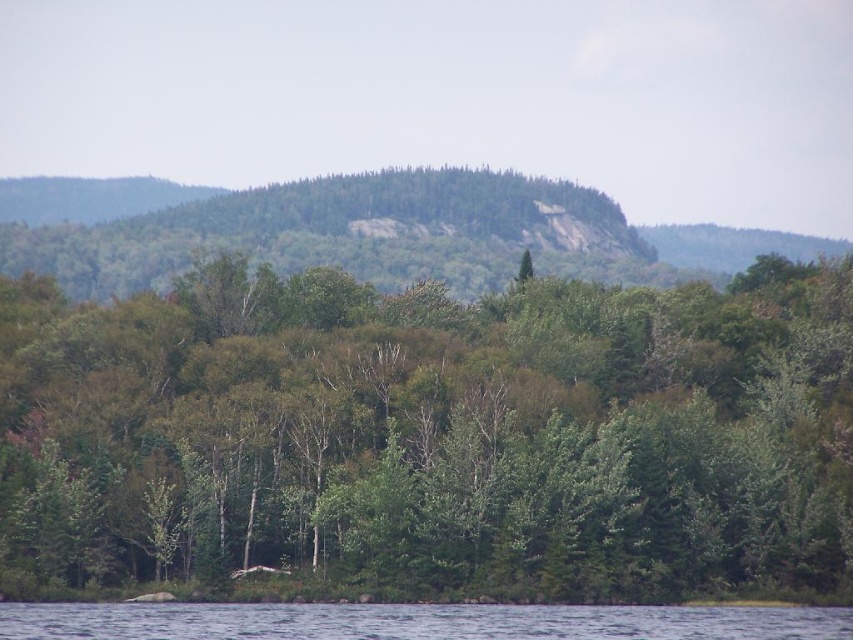
Can you confirm if green leafy trees at center is positioned to the right of clear water at lower center?

In fact, green leafy trees at center is to the left of clear water at lower center.

Is green leafy trees at center shorter than clear water at lower center?

No, green leafy trees at center is not shorter than clear water at lower center.

Between point (753, 484) and point (306, 632), which one is positioned in front?

Point (306, 632)

Where is `green leafy trees at center`? green leafy trees at center is located at coordinates coord(432,436).